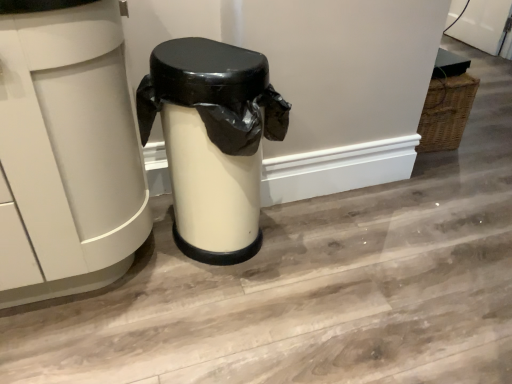
This screenshot has height=384, width=512. Identify the location of vacant point to the right of matte white trash can at center, the 1th waste container from the right. (335, 259).